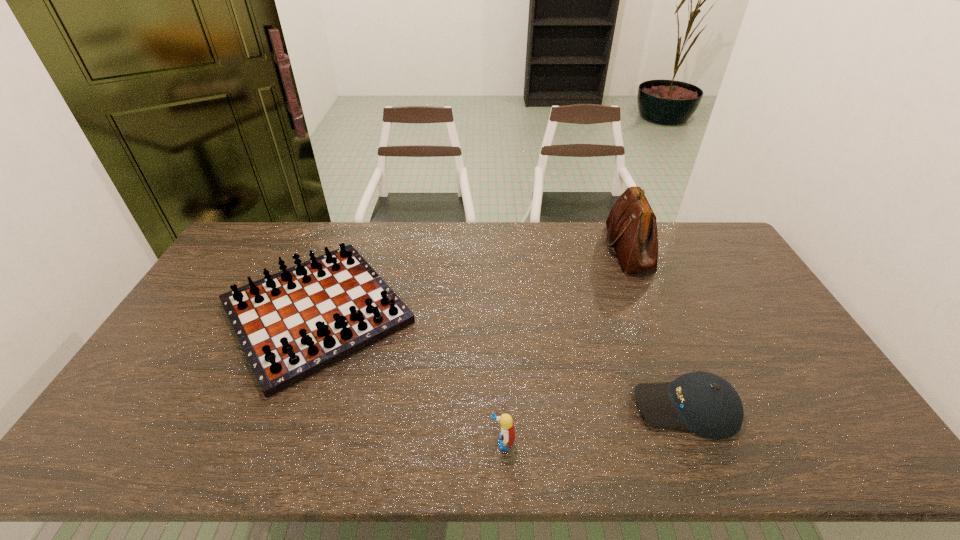
Identify the location of vacant area that lies between the third object from right to left and the tallest object. This screenshot has width=960, height=540. (565, 345).

Locate an element on the screen. vacant space in between the tallest object and the baseball cap is located at coordinates (657, 328).

This screenshot has height=540, width=960. What are the coordinates of `object that is the third closest one to the second object from left to right` in the screenshot? It's located at (631, 224).

Identify which object is located as the second nearest to the leftmost object. Please provide its 2D coordinates. Your answer should be formatted as a tuple, i.e. [(x, y)], where the tuple contains the x and y coordinates of a point satisfying the conditions above.

[(706, 404)]

At what (x,y) coordinates should I click in order to perform the action: click on free region that satisfies the following two spatial constraints: 1. on the front side of the shoulder bag; 2. on the front-facing side of the Lego. Please return your answer as a coordinate pair (x, y). The image size is (960, 540). Looking at the image, I should click on (708, 442).